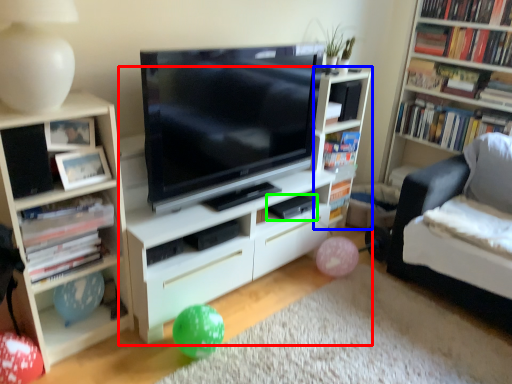
Question: Estimate the real-world distances between objects in this image. Which object is farther from shelf (highlighted by a red box), shelf (highlighted by a blue box) or paperback book (highlighted by a green box)?

Choices:
 (A) shelf
 (B) paperback book

Answer: (B)